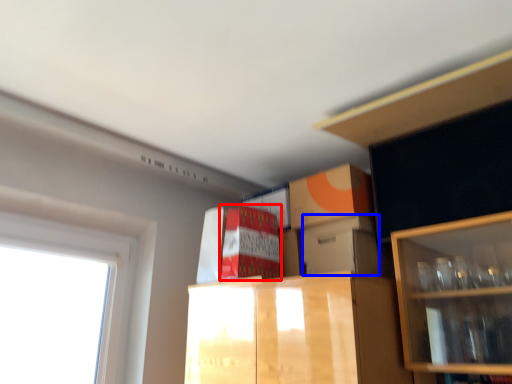
Question: Which object is further to the camera taking this photo, cabinetry (highlighted by a red box) or storage box (highlighted by a blue box)?

Choices:
 (A) cabinetry
 (B) storage box

Answer: (A)